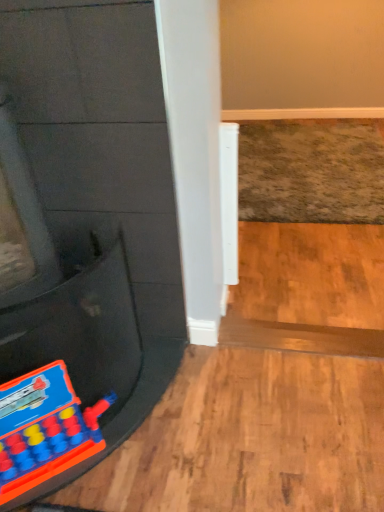
Measure the distance between plastic toy train at lower left and camera.

The distance of plastic toy train at lower left from camera is 3.63 feet.

Where is `plastic toy train at lower left`? The image size is (384, 512). plastic toy train at lower left is located at coordinates [x=44, y=429].

This screenshot has width=384, height=512. Describe the element at coordinates (44, 429) in the screenshot. I see `plastic toy train at lower left` at that location.

Locate an element on the screen. The image size is (384, 512). plastic toy train at lower left is located at coordinates (44, 429).